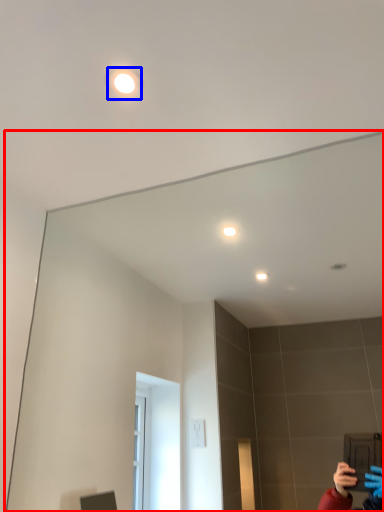
Question: Which of the following is the farthest to the observer, mirror (highlighted by a red box) or light (highlighted by a blue box)?

Choices:
 (A) mirror
 (B) light

Answer: (B)